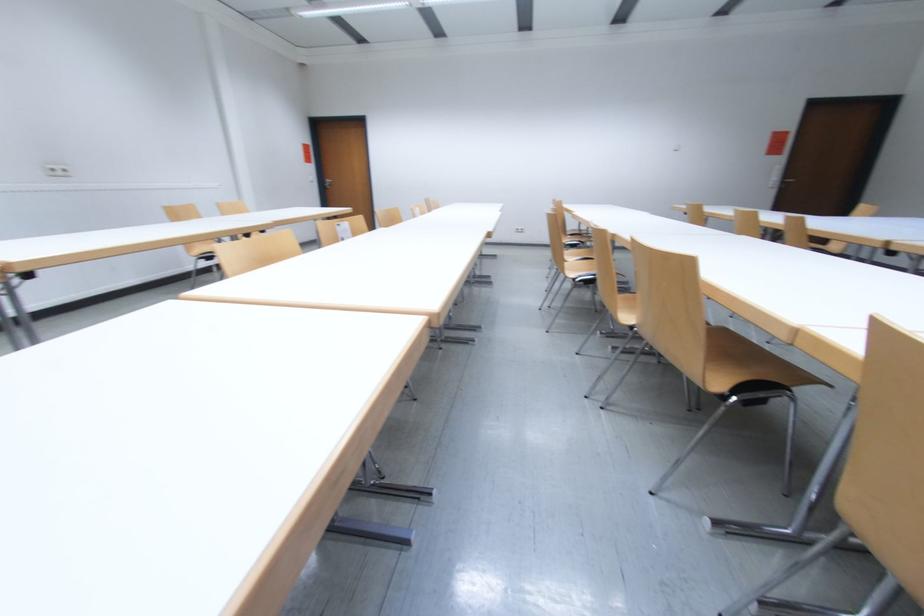
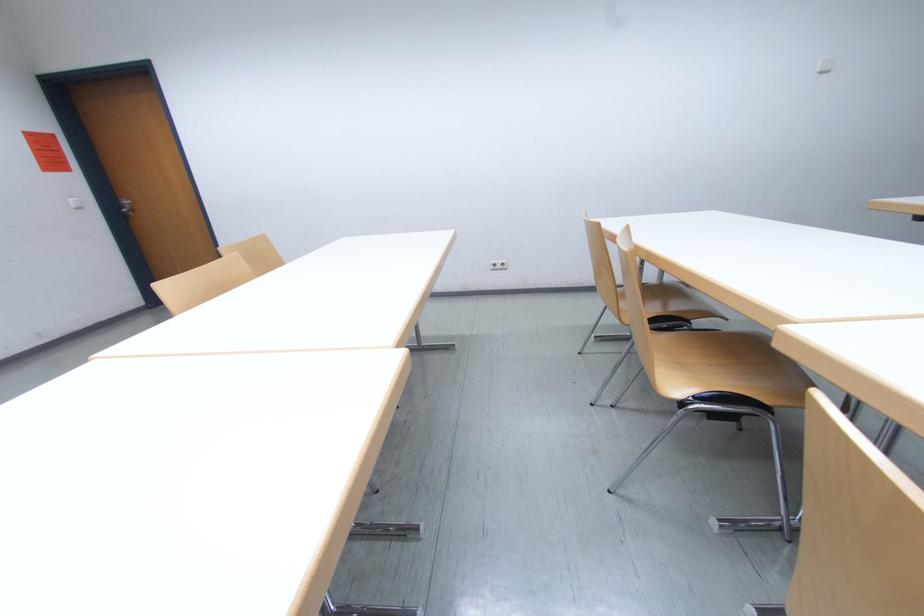
Locate, in the second image, the point that corresponds to [528,231] in the first image.

(505, 265)